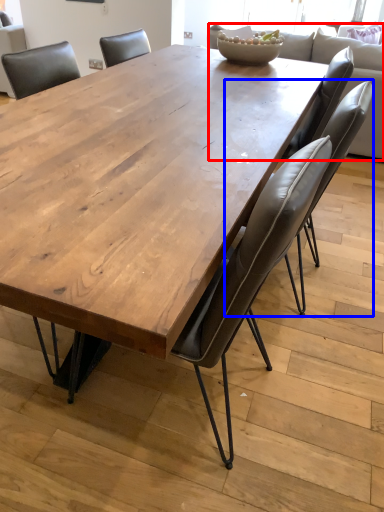
Question: Which object appears farthest to the camera in this image, couch (highlighted by a red box) or chair (highlighted by a blue box)?

Choices:
 (A) couch
 (B) chair

Answer: (A)